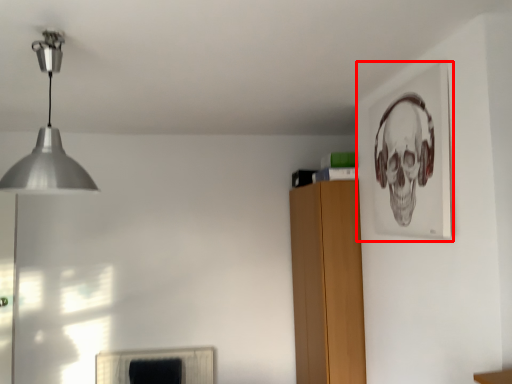
Question: From the image's perspective, where is picture frame (annotated by the red box) located in relation to lamp in the image?

Choices:
 (A) below
 (B) above

Answer: (A)